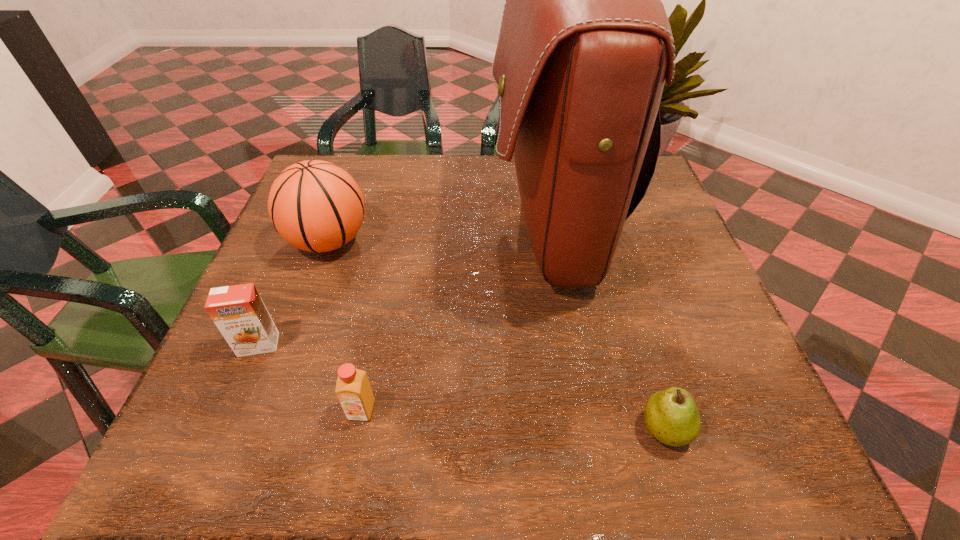
Identify the location of pear at the right edge. This screenshot has width=960, height=540. (671, 415).

Identify the location of object at the far right corner. (585, 44).

Where is `object located at the near right corner`? The height and width of the screenshot is (540, 960). object located at the near right corner is located at coordinates (671, 415).

At what (x,y) coordinates should I click in order to perform the action: click on vacant region at the far edge of the desktop. Please return your answer as a coordinate pair (x, y). The width and height of the screenshot is (960, 540). Looking at the image, I should click on (406, 206).

The image size is (960, 540). Identify the location of free space at the near edge of the desktop. (440, 424).

Identify the location of blank space at the left edge. (283, 242).

The image size is (960, 540). What are the coordinates of `vacant region at the right edge` in the screenshot? It's located at (647, 327).

Locate an element on the screen. This screenshot has height=540, width=960. vacant space at the far left corner is located at coordinates (345, 168).

Where is `vacant area at the near right corner`? vacant area at the near right corner is located at coordinates (780, 457).

The image size is (960, 540). I want to click on free space between the nearer orange juice and the pear, so click(x=513, y=420).